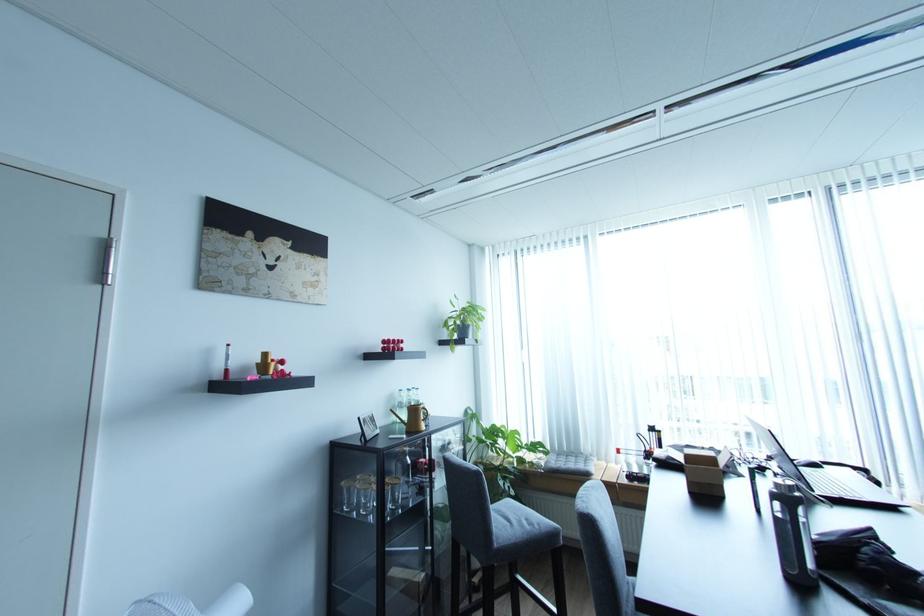
In order to click on grey chair sitting surface in this screenshot , I will do `click(520, 531)`.